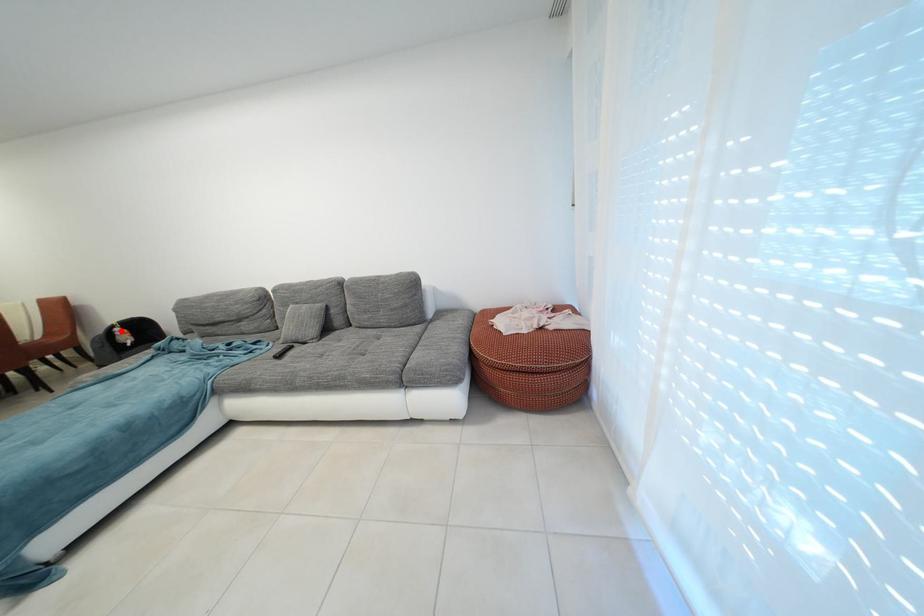
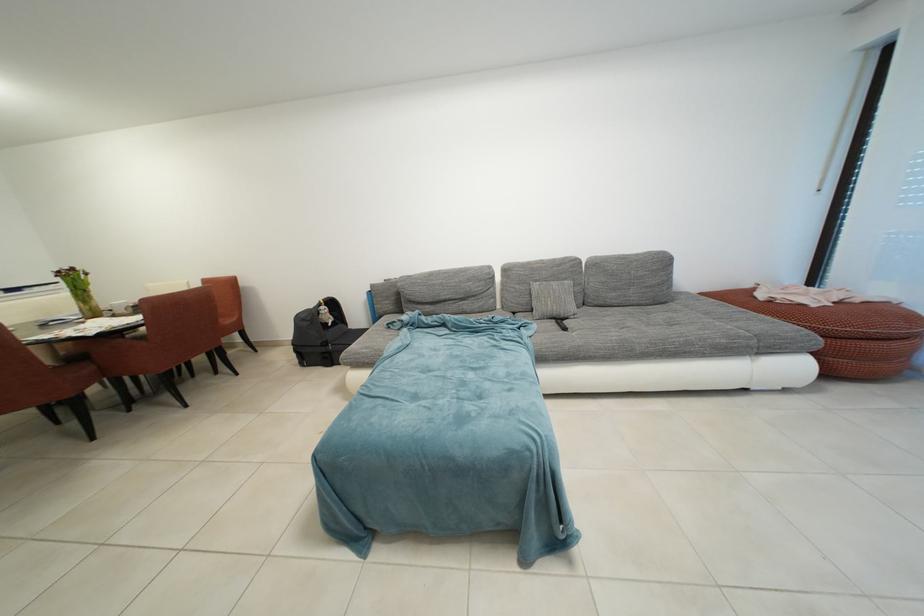
Find the pixel in the second image that matches the highlighted location in the first image.

(329, 309)